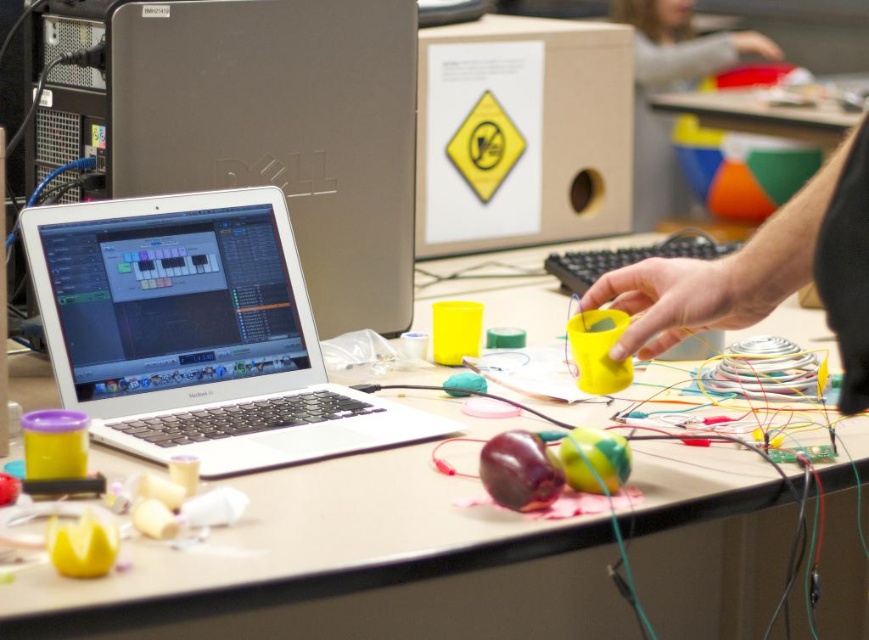
You are a robot trying to pick up the yellow matte cup at center. What are the coordinates where you should move your robotic arm to grab it?

The coordinates for the yellow matte cup at center are at point (x=596, y=349).

You are standing in front of the workspace and want to pick up the smooth plastic ball at upper right without moving any other objects. Can you reach it while staying in your current position?

The smooth plastic ball at upper right is 2.50 meters away from the viewer, so you cannot reach it without moving closer or using an object to extend your reach.

You are standing at the point marked as point (67, 225) and want to take a photo of the entire workspace. Is the camera positioned at a distance that allows capturing the whole area? Please consider the camera distance of 37.79 inches from the point.

The camera is 37.79 inches away from point (67, 225). Since the workspace is cluttered with various items like cups and wires, this distance might be sufficient to capture most of the area, but it depends on the camera lens and field of view. However, based on the given information, the camera is positioned at 37.79 inches from the point, which could potentially include the entire workspace in the frame.